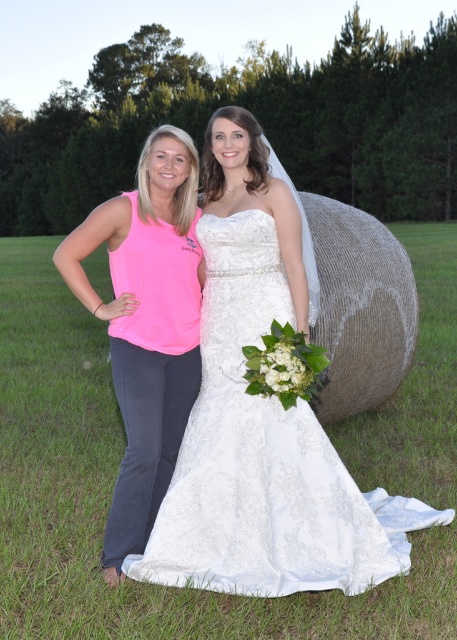
Question: Does white lace dress at center lie in front of pink fabric tank top at left?

Choices:
 (A) no
 (B) yes

Answer: (B)

Question: In this image, where is white lace dress at center located relative to pink fabric tank top at left?

Choices:
 (A) below
 (B) above

Answer: (A)

Question: Is white lace dress at center in front of pink fabric tank top at left?

Choices:
 (A) no
 (B) yes

Answer: (B)

Question: Which point is farther to the camera?

Choices:
 (A) (125, 220)
 (B) (287, 509)

Answer: (A)